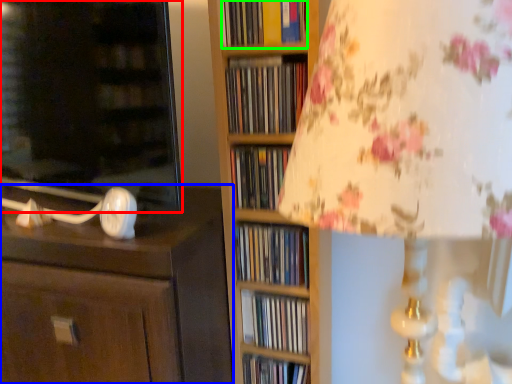
Question: Estimate the real-world distances between objects in this image. Which object is farther from cabinetry (highlighted by a red box), chest of drawers (highlighted by a blue box) or book (highlighted by a green box)?

Choices:
 (A) chest of drawers
 (B) book

Answer: (B)